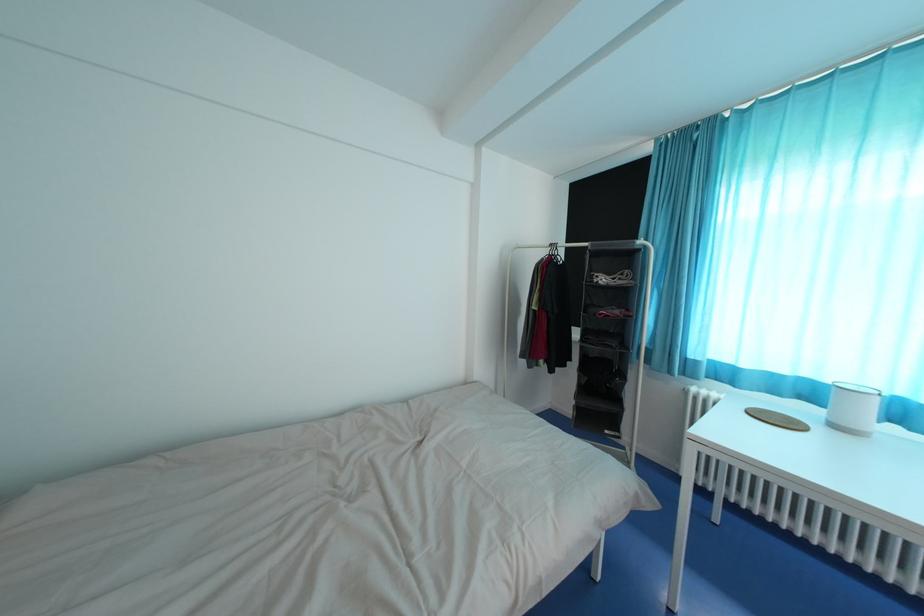
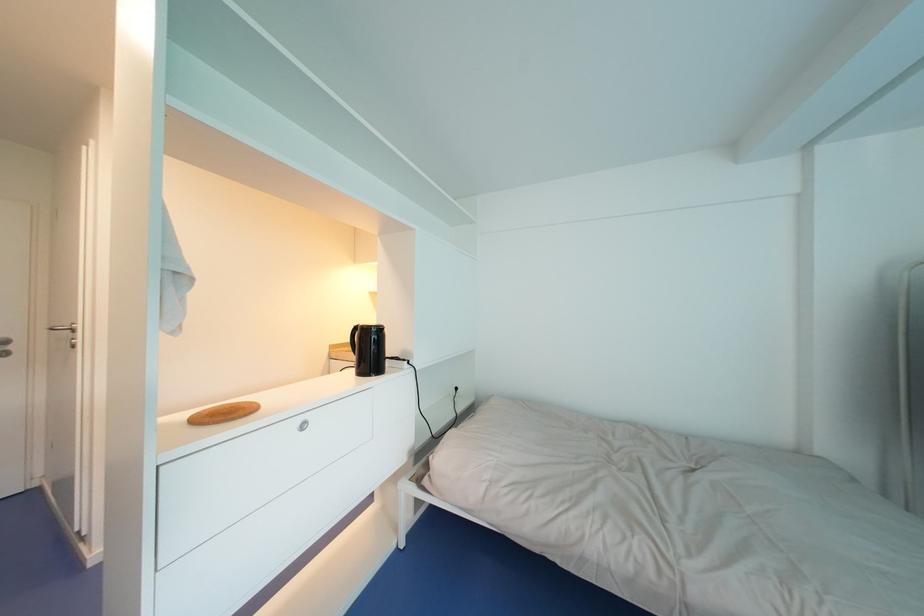
Question: How did the camera likely rotate?

Choices:
 (A) Left
 (B) Right
 (C) Up
 (D) Down

Answer: (A)